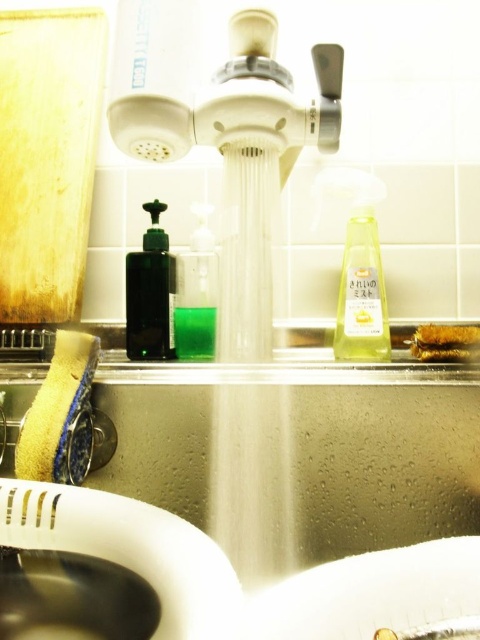
You are a chef trying to reach the translucent dark green bottle at center to get dish soap. There is a translucent yellow liquid at center in the way. Can you move the liquid out of the way to access the bottle?

The translucent yellow liquid at center is in front of the translucent dark green bottle at center, so you can move the liquid to access the bottle behind it.

In the kitchen sink scene, you see a yellow bristle brush at sink right and a green matte liquid at sink center. Which object is positioned more to the right?

The yellow bristle brush at sink right is positioned more to the right than the green matte liquid at sink center.